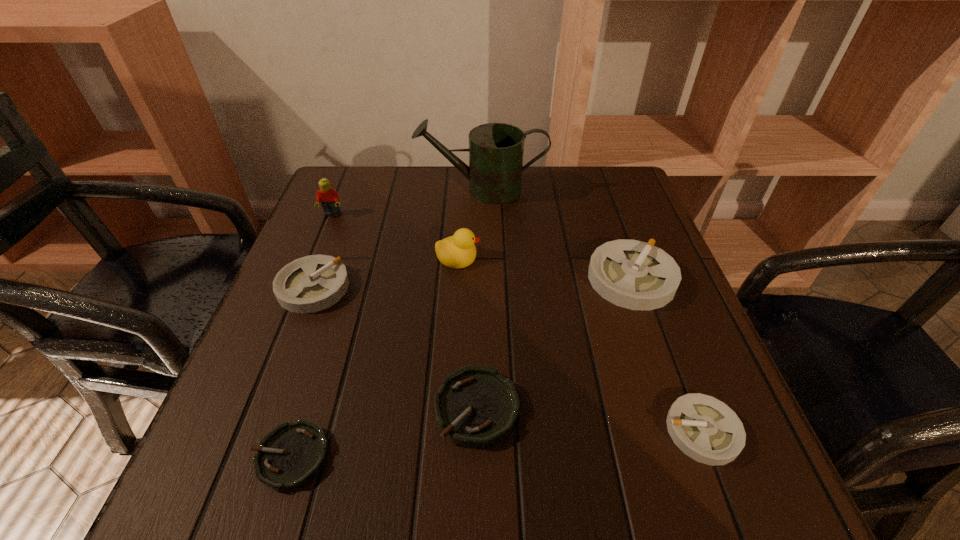
Find the location of a particular element. The image size is (960, 540). vacant area located 0.350m on the left of the biggest gray ashtray is located at coordinates (420, 279).

At what (x,y) coordinates should I click in order to perform the action: click on vacant space located 0.380m on the back of the second biggest gray ashtray. Please return your answer as a coordinate pair (x, y). Image resolution: width=960 pixels, height=540 pixels. Looking at the image, I should click on click(x=357, y=172).

Image resolution: width=960 pixels, height=540 pixels. What are the coordinates of `free space located 0.210m on the left of the nearest gray ashtray` in the screenshot? It's located at (531, 431).

Locate an element on the screen. vacant area situated on the left of the third ashtray from right to left is located at coordinates (303, 408).

The width and height of the screenshot is (960, 540). What are the coordinates of `blank area located on the back of the left green ashtray` in the screenshot? It's located at (353, 255).

Image resolution: width=960 pixels, height=540 pixels. Identify the location of watering can at the far edge. (496, 150).

Where is `Lego that is at the far edge`? Image resolution: width=960 pixels, height=540 pixels. Lego that is at the far edge is located at coordinates (329, 198).

Where is `Lego at the left edge`? This screenshot has width=960, height=540. Lego at the left edge is located at coordinates (329, 198).

This screenshot has height=540, width=960. In order to click on object present at the far left corner in this screenshot , I will do `click(329, 198)`.

The width and height of the screenshot is (960, 540). In order to click on object positioned at the near left corner in this screenshot , I will do `click(292, 454)`.